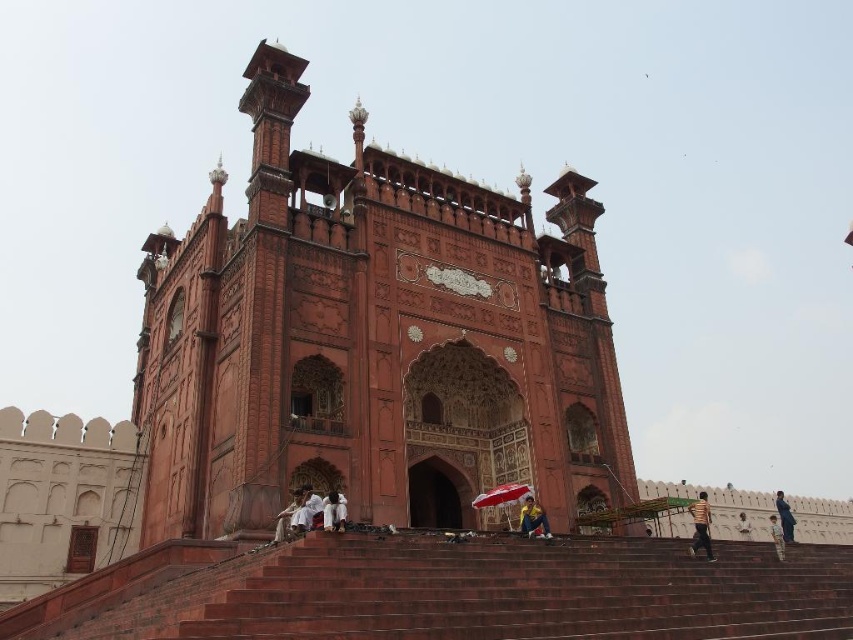
Is white cotton shirt at lower center positioned in front of white cotton shirt at lower right?

Yes, it is.

Does white cotton shirt at lower center appear over white cotton shirt at lower right?

Yes.

Who is more forward, (279, 536) or (746, 524)?

Point (279, 536) is in front.

I want to click on white cotton shirt at lower center, so click(287, 515).

Is blue fabric umbrella at center in front of light brown fabric pants at lower right?

Yes, it is in front of light brown fabric pants at lower right.

Who is more distant from viewer, (543,528) or (776,548)?

The point (776,548) is more distant.

Is point (537, 524) more distant than point (778, 554)?

That is False.

The width and height of the screenshot is (853, 640). I want to click on blue fabric umbrella at center, so click(532, 518).

Who is more distant from viewer, (689, 547) or (785, 500)?

The point (785, 500) is behind.

Describe the element at coordinates (701, 525) in the screenshot. I see `yellow striped shirt at lower right` at that location.

Is point (693, 550) positioned behind point (788, 518)?

No, (693, 550) is in front of (788, 518).

The image size is (853, 640). I want to click on yellow striped shirt at lower right, so click(701, 525).